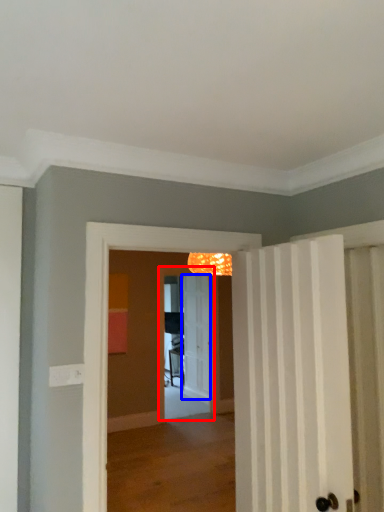
Question: Which object appears farthest to the camera in this image, screen door (highlighted by a red box) or door (highlighted by a blue box)?

Choices:
 (A) screen door
 (B) door

Answer: (B)